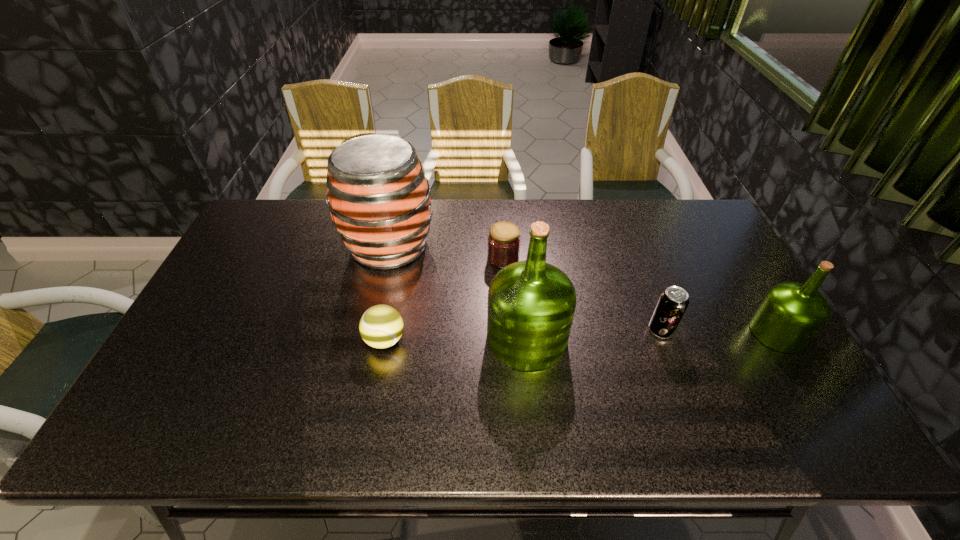
Please point a vacant point for placing a olive oil on the left. Please provide its 2D coordinates. Your answer should be formatted as a tuple, i.e. [(x, y)], where the tuple contains the x and y coordinates of a point satisfying the conditions above.

[(271, 343)]